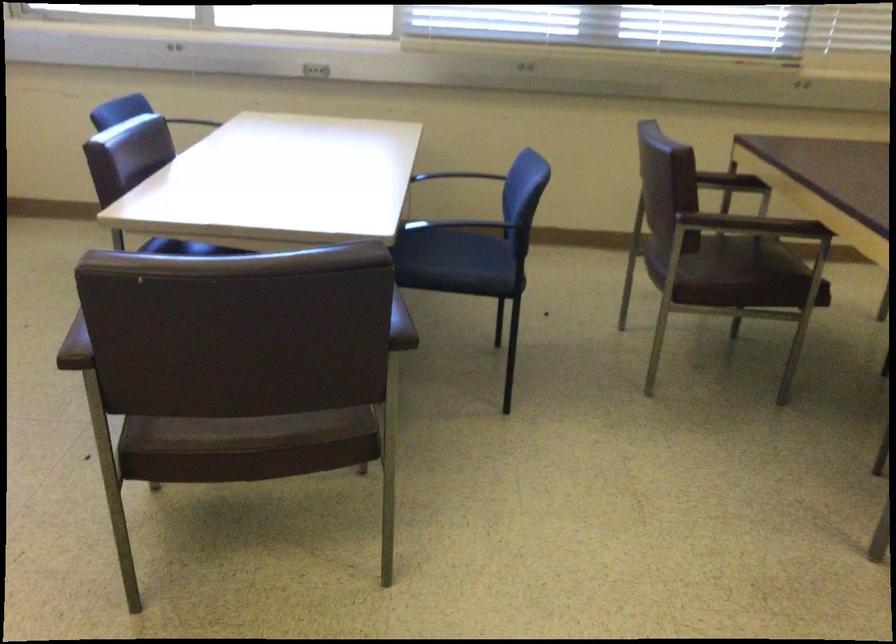
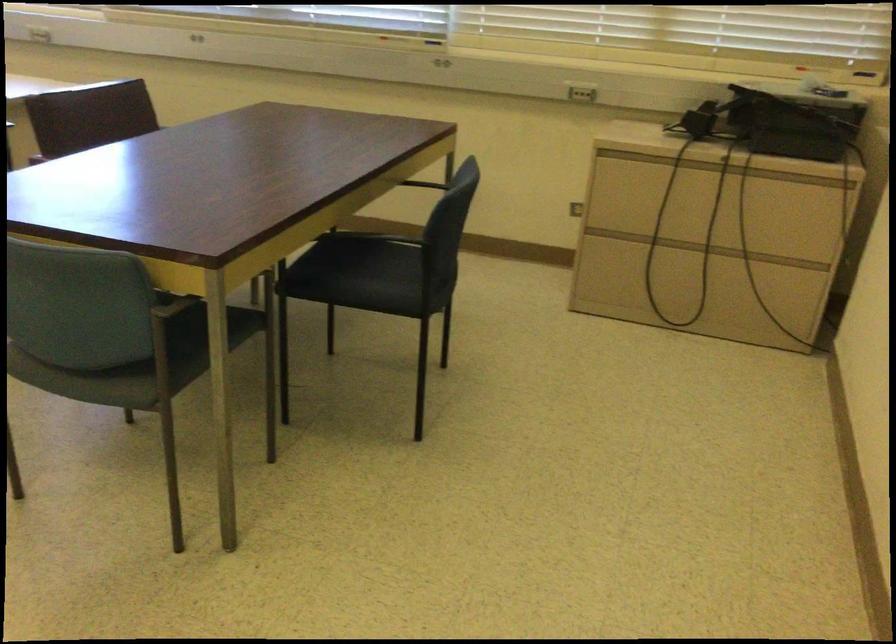
Question: What movement of the cameraman would produce the second image?

Choices:
 (A) Left
 (B) Right
 (C) Forward
 (D) Backward

Answer: (B)